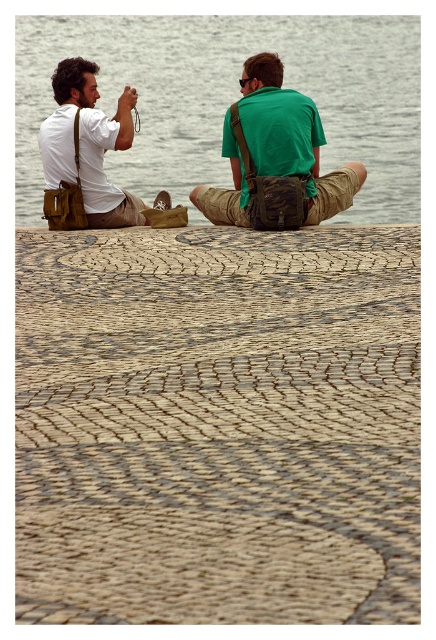
Does gray water at center have a larger size compared to matte brown bag at left?

Correct, gray water at center is larger in size than matte brown bag at left.

Consider the image. Is gray water at center shorter than matte brown bag at left?

No.

Locate an element on the screen. The width and height of the screenshot is (436, 640). gray water at center is located at coordinates (231, 97).

Describe the element at coordinates (275, 157) in the screenshot. I see `khaki fabric bag at center` at that location.

Where is `khaki fabric bag at center`? khaki fabric bag at center is located at coordinates (275, 157).

Measure the distance between point (411, 92) and camera.

22.47 meters

The height and width of the screenshot is (640, 436). I want to click on gray water at center, so click(231, 97).

Which is behind, point (186, 67) or point (225, 115)?

The point (186, 67) is behind.

Identify the location of gray water at center. (231, 97).